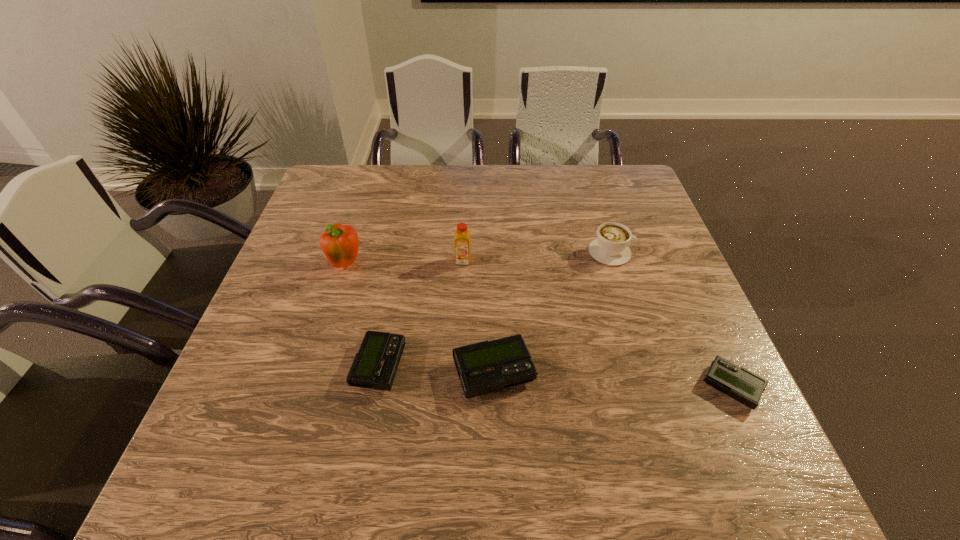
Identify the location of cappuccino. The width and height of the screenshot is (960, 540). (611, 247).

Locate an element on the screen. Image resolution: width=960 pixels, height=540 pixels. vacant space situated on the back of the fifth object from right to left is located at coordinates (390, 312).

I want to click on free region located on the left of the tallest beeper, so click(384, 373).

Identify the location of blank space located 0.090m on the back of the shortest object. Image resolution: width=960 pixels, height=540 pixels. (706, 329).

This screenshot has width=960, height=540. What are the coordinates of `free location located on the back of the pepper` in the screenshot? It's located at (365, 209).

The image size is (960, 540). In order to click on vacant space located 0.240m on the front and back of the orange juice in this screenshot , I will do `click(460, 342)`.

Image resolution: width=960 pixels, height=540 pixels. I want to click on vacant point located 0.050m to the right of the cappuccino's handle, so (651, 253).

Find the location of `object that is positioned at the left edge`. object that is positioned at the left edge is located at coordinates (340, 243).

Where is `beeper located at the right edge`? Image resolution: width=960 pixels, height=540 pixels. beeper located at the right edge is located at coordinates (736, 382).

What are the coordinates of `cappuccino positioned at the right edge` in the screenshot? It's located at (611, 247).